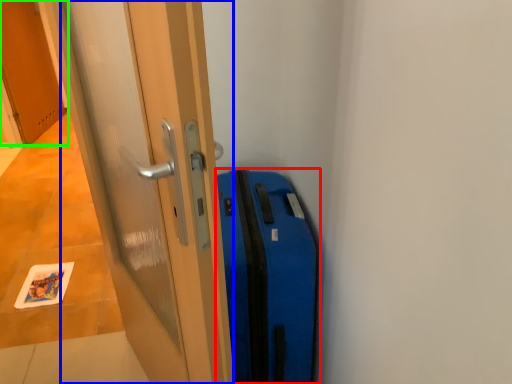
Question: Estimate the real-world distances between objects in this image. Which object is closer to suitcase (highlighted by a red box), door (highlighted by a blue box) or door (highlighted by a green box)?

Choices:
 (A) door
 (B) door

Answer: (A)